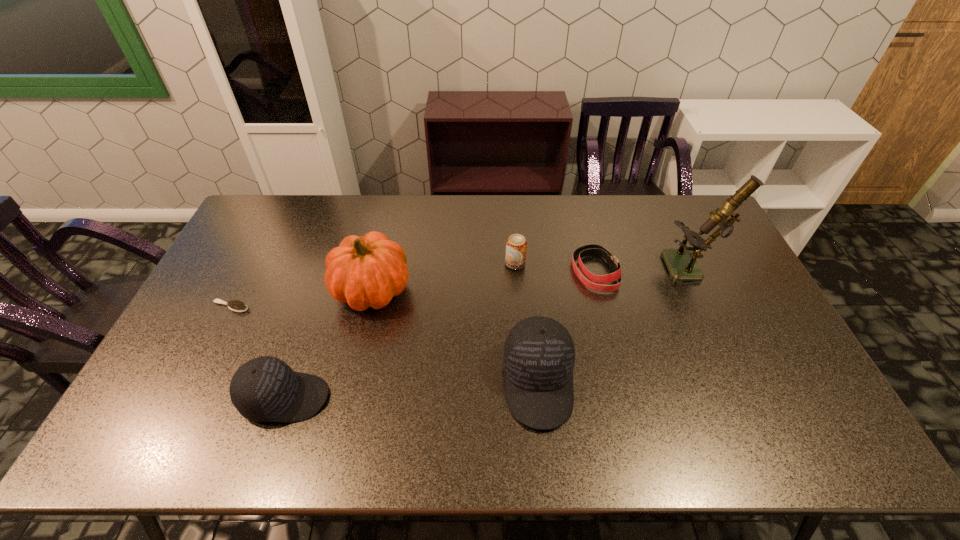
The width and height of the screenshot is (960, 540). I want to click on the second shortest object, so click(x=592, y=249).

At what (x,y) coordinates should I click in order to perform the action: click on free space located at the front of the left baseball cap where the brim is located. Please return your answer as a coordinate pair (x, y). The height and width of the screenshot is (540, 960). Looking at the image, I should click on (392, 398).

Identify the location of vacant space located 0.140m on the left of the pumpkin. (288, 289).

The image size is (960, 540). Identify the location of vacant space located at the eyepiece of the rightmost object. (617, 270).

The width and height of the screenshot is (960, 540). I want to click on vacant region located at the eyepiece of the rightmost object, so click(x=584, y=270).

Where is `free spot located 0.240m at the eyepiece of the rightmost object`? free spot located 0.240m at the eyepiece of the rightmost object is located at coordinates (593, 270).

Find the location of a particular element. This screenshot has height=540, width=960. vacant space located 0.150m on the back of the beer can is located at coordinates (513, 228).

This screenshot has width=960, height=540. What are the coordinates of `free region located on the right of the leftmost object` in the screenshot? It's located at (372, 307).

Locate an element on the screen. free space located 0.160m on the left of the dog collar is located at coordinates (523, 271).

Locate an element on the screen. Image resolution: width=960 pixels, height=540 pixels. object that is at the left edge is located at coordinates (235, 305).